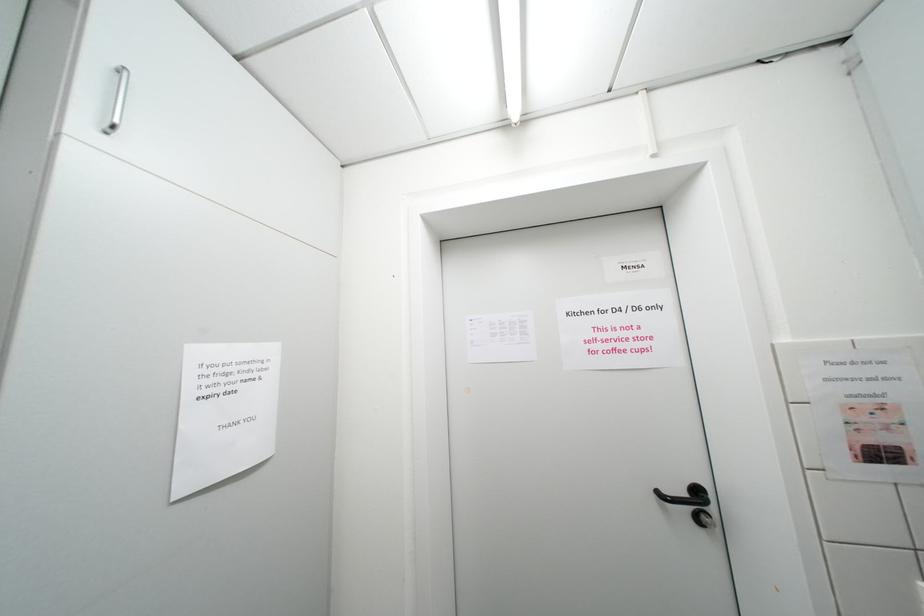
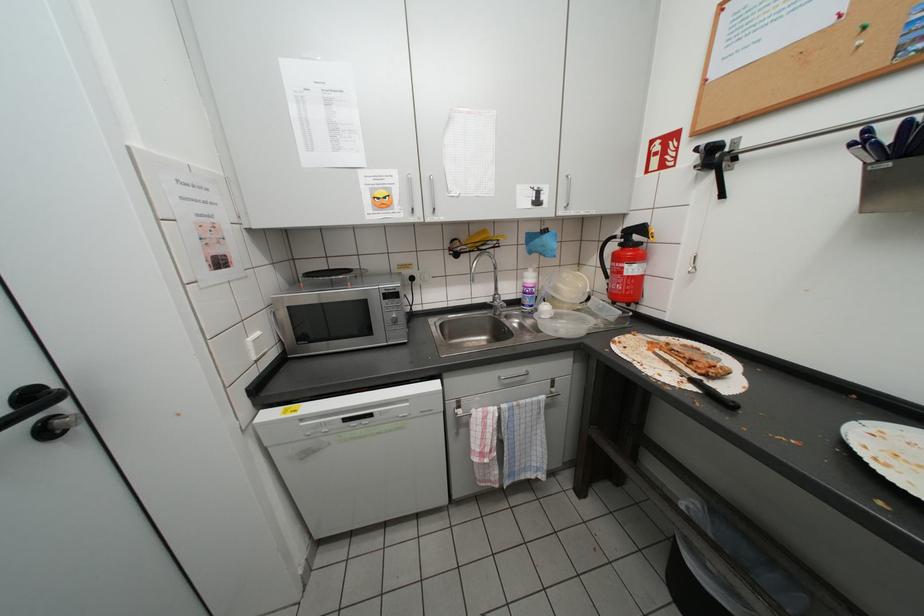
Question: The camera is either moving clockwise (left) or counter-clockwise (right) around the object. The first image is from the beginning of the video and the second image is from the end. Is the camera moving left or right when shooting the video?

Choices:
 (A) Left
 (B) Right

Answer: (A)